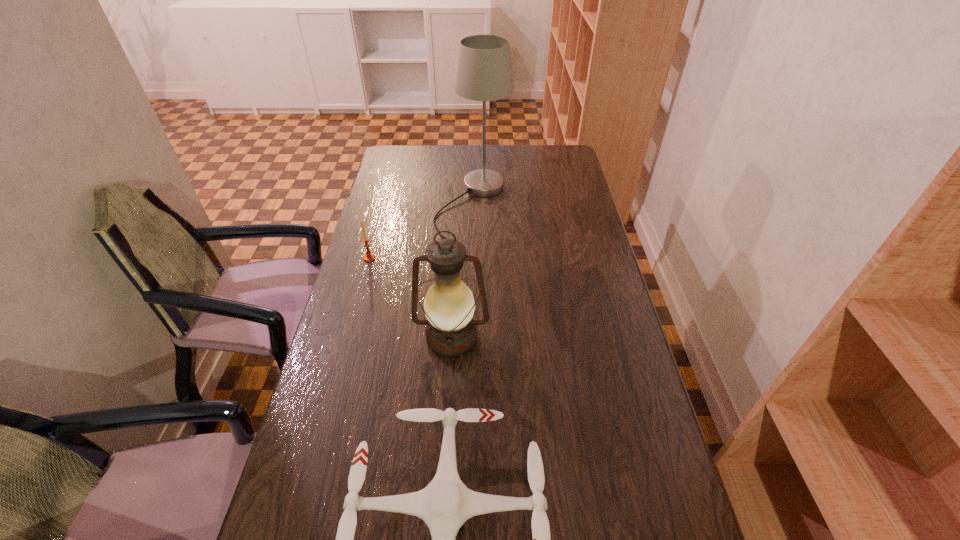
The image size is (960, 540). I want to click on vacant space that satisfies the following two spatial constraints: 1. on the back side of the table lamp; 2. on the right side of the third shortest object, so click(459, 205).

The width and height of the screenshot is (960, 540). Identify the location of vacant position in the image that satisfies the following two spatial constraints: 1. on the back side of the farthest object; 2. on the right side of the oil lamp. (459, 205).